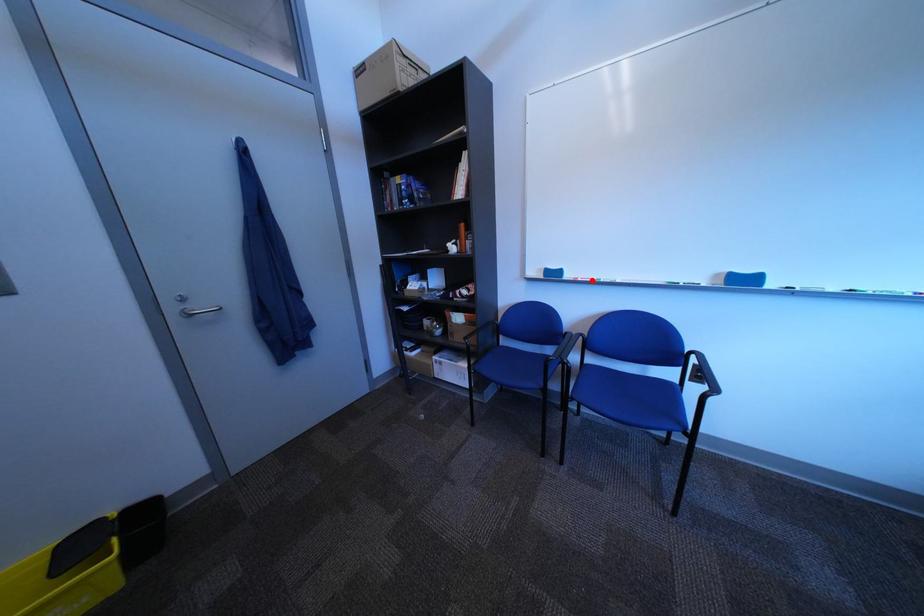
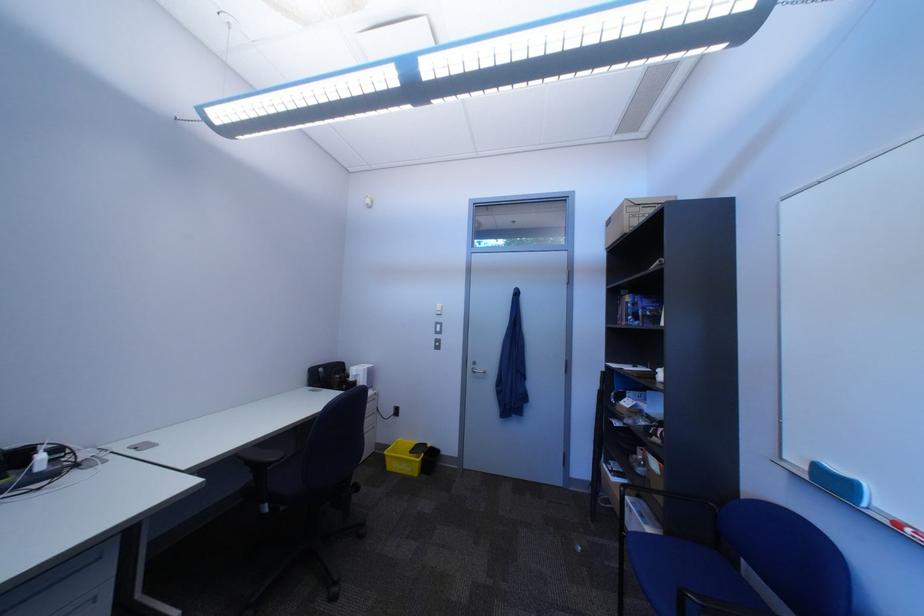
Locate, in the second image, the point that corresponds to the highlighted location in the first image.

(915, 527)